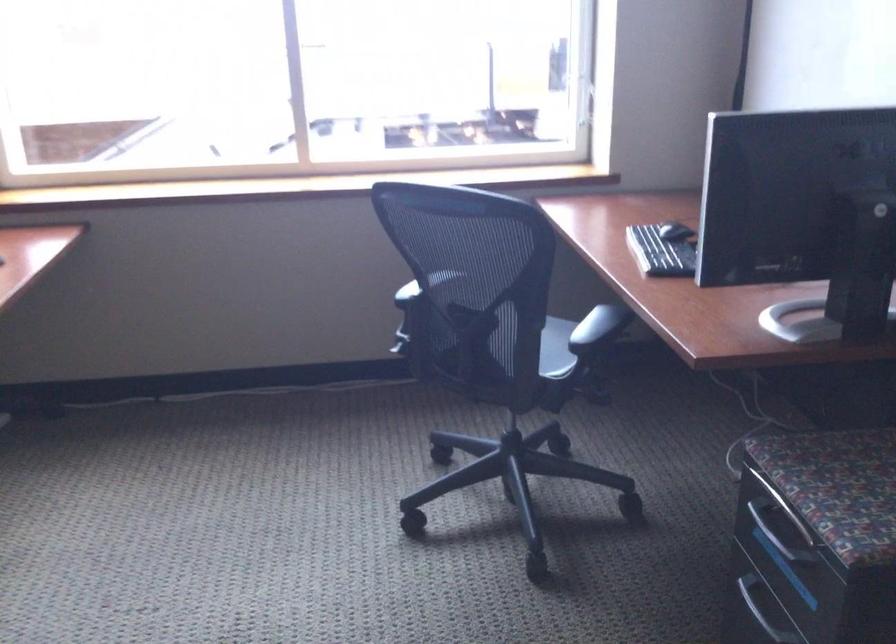
What do you see at coordinates (599, 327) in the screenshot?
I see `a chair armrest` at bounding box center [599, 327].